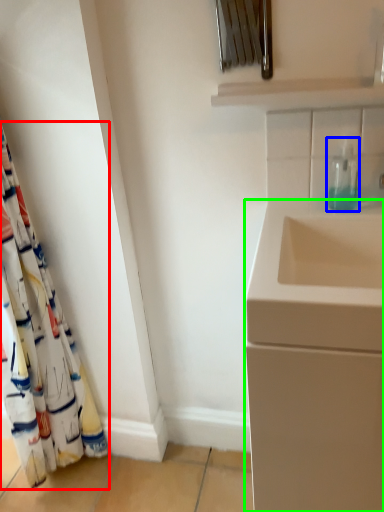
Question: Based on their relative distances, which object is nearer to curtain (highlighted by a red box)? Choose from soap dispenser (highlighted by a blue box) and bathroom cabinet (highlighted by a green box).

Choices:
 (A) soap dispenser
 (B) bathroom cabinet

Answer: (B)